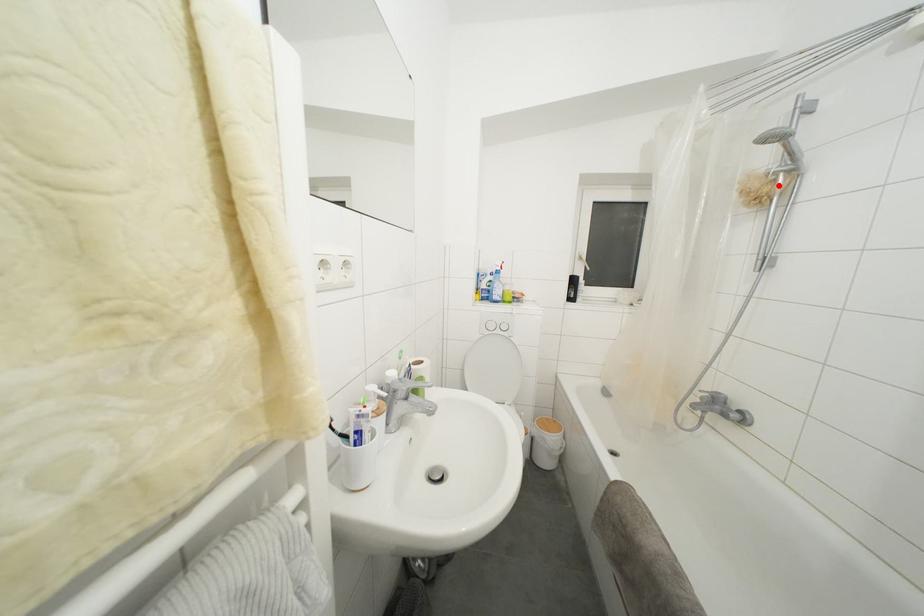
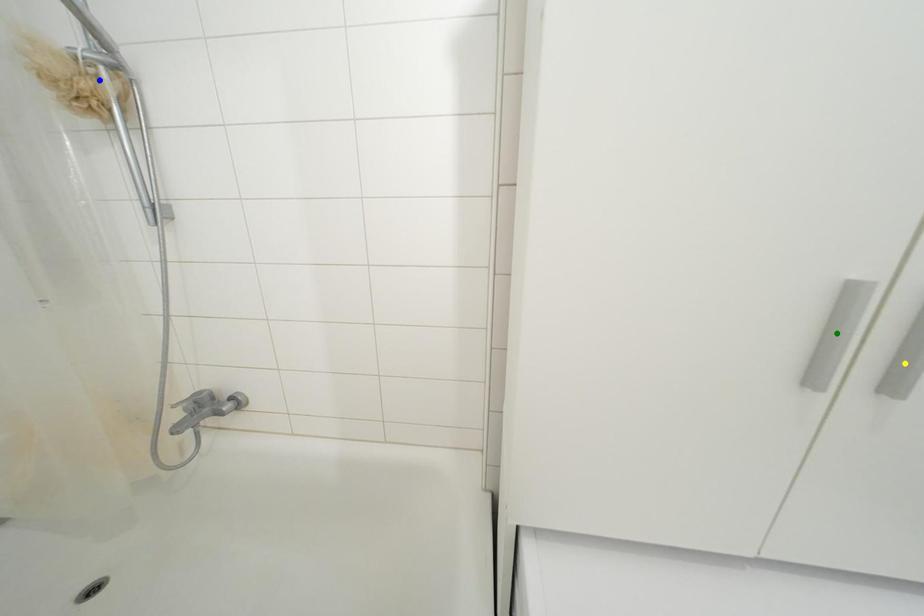
Question: I am providing you with two images of the same scene from different viewpoints. A red point is marked on the first image. You are given multiple points on the second image. Can you choose the point in image 2 that corresponds to the point in image 1?

Choices:
 (A) blue point
 (B) yellow point
 (C) green point

Answer: (A)